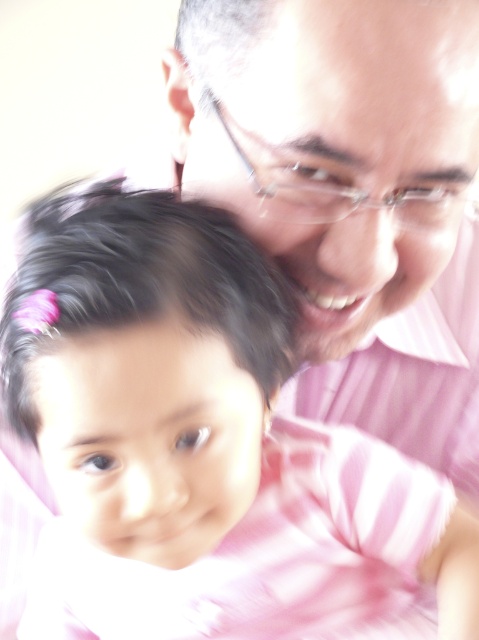
Question: Which of the following is the farthest from the observer?

Choices:
 (A) clear plastic glasses at upper center
 (B) pink striped shirt at center

Answer: (A)

Question: Where is pink striped shirt at center located in relation to clear plastic glasses at upper center in the image?

Choices:
 (A) above
 (B) below

Answer: (B)

Question: Does pink striped shirt at center have a smaller size compared to clear plastic glasses at upper center?

Choices:
 (A) yes
 (B) no

Answer: (B)

Question: Which object is farther from the camera taking this photo?

Choices:
 (A) pink striped shirt at center
 (B) clear plastic glasses at upper center

Answer: (B)

Question: Is the position of pink striped shirt at center less distant than that of clear plastic glasses at upper center?

Choices:
 (A) yes
 (B) no

Answer: (A)